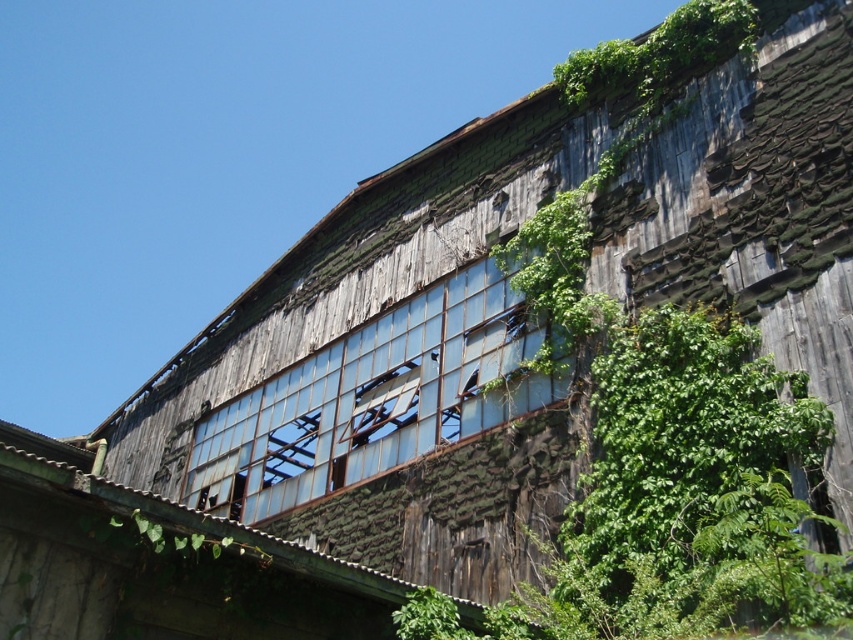
You are a painter wanting to paint the transparent glass window at center. However, there are green leafy vines at upper right above it. Can you see the window clearly from the ground below?

The transparent glass window at center is positioned under green leafy vines at upper right, so the vines may block your view of the window from below. You might need to move the vines or adjust your angle to see it clearly.

You are a painter who wants to paint the transparent glass window at center and the green leafy vines at upper right. Which object requires a larger canvas to capture its full view?

The green leafy vines at upper right require a larger canvas since they are bigger in size compared to the transparent glass window at center.

You are standing outside the dilapidated wooden structure and want to look through the transparent glass window at center. However, there are green leafy vines at upper right blocking your view. According to the scene description, which object is positioned to the left of the other, and does this affect your ability to see through the window?

The transparent glass window at center is to the left of green leafy vines at upper right. Since the vines are at the upper right, they may partially block the upper portion of the window, but the lower part might still be visible depending on their spread.